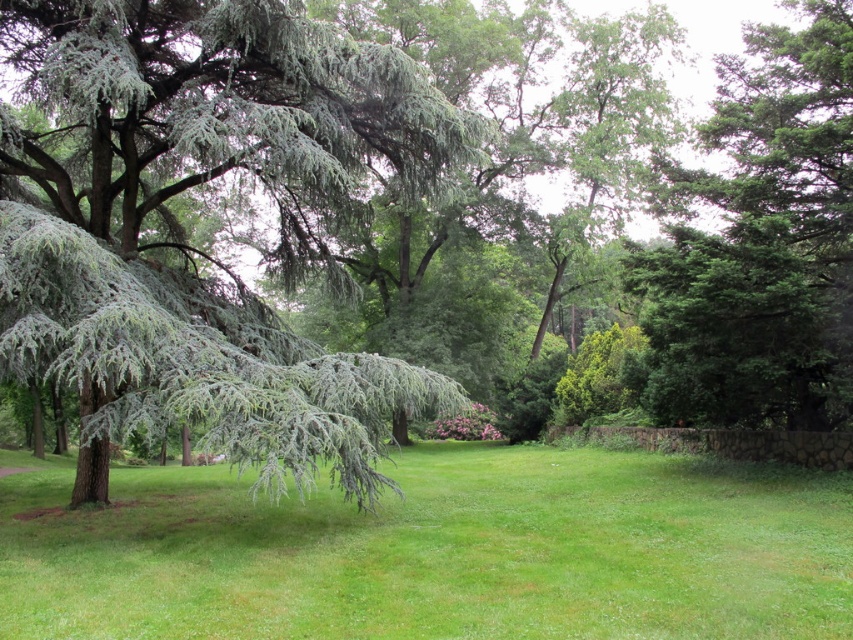
Question: Considering the real-world distances, which object is farthest from the green grass at center?

Choices:
 (A) green needle-like at left
 (B) green leafy tree at upper right

Answer: (B)

Question: Which point appears farthest from the camera in this image?

Choices:
 (A) (260, 547)
 (B) (770, 289)
 (C) (22, 324)

Answer: (B)

Question: Which of the following is the closest to the observer?

Choices:
 (A) (688, 556)
 (B) (386, 54)

Answer: (A)

Question: Is green grass at center in front of green leafy tree at upper right?

Choices:
 (A) yes
 (B) no

Answer: (A)

Question: Is green needle-like at left positioned behind green leafy tree at upper right?

Choices:
 (A) no
 (B) yes

Answer: (A)

Question: Does green grass at center lie in front of green leafy tree at upper right?

Choices:
 (A) yes
 (B) no

Answer: (A)